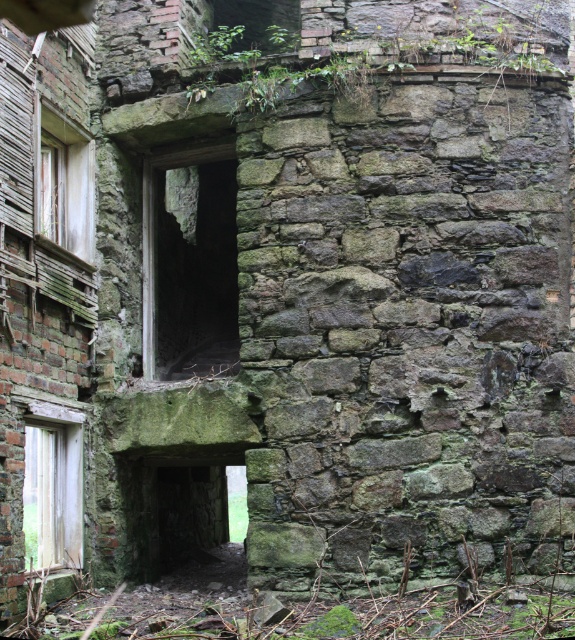
Question: Can you confirm if green stone window at center is smaller than wooden window at left?

Choices:
 (A) yes
 (B) no

Answer: (B)

Question: Is wooden door at left bigger than wooden window at left?

Choices:
 (A) no
 (B) yes

Answer: (A)

Question: Which of the following is the closest to the observer?

Choices:
 (A) wooden door at left
 (B) green stone window at center
 (C) wooden window at left

Answer: (A)

Question: Estimate the real-world distances between objects in this image. Which object is closer to the wooden window at left?

Choices:
 (A) green stone window at center
 (B) wooden door at left

Answer: (A)

Question: Which of the following is the farthest from the observer?

Choices:
 (A) (41, 465)
 (B) (217, 230)

Answer: (B)

Question: Is green stone window at center wider than wooden window at left?

Choices:
 (A) no
 (B) yes

Answer: (B)